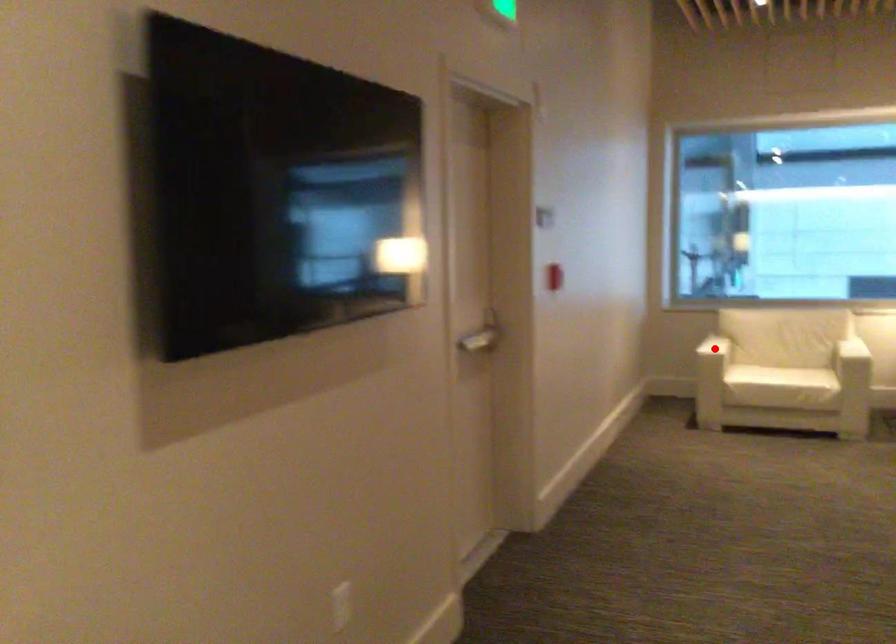
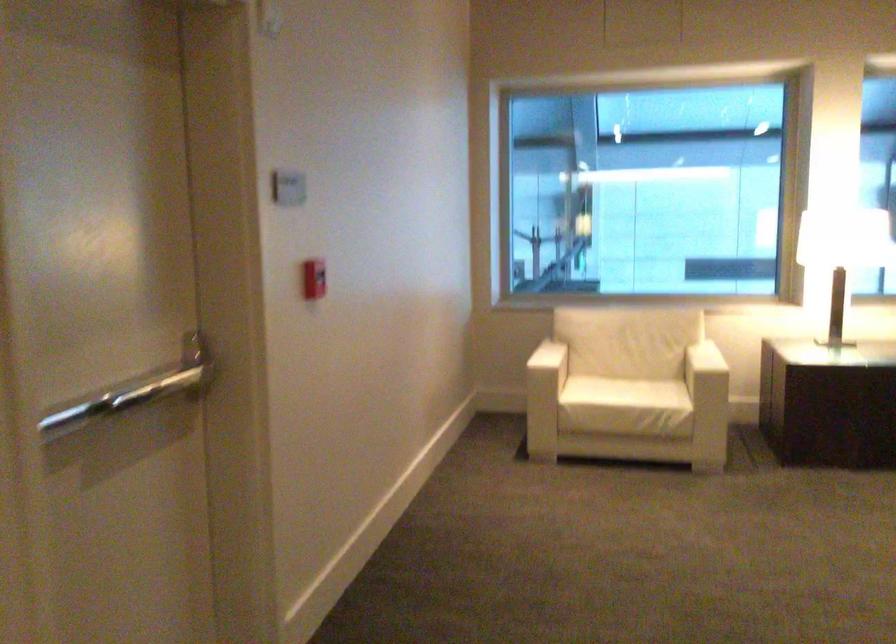
Question: A red point is marked in image1. In image2, is the corresponding 3D point closer to the camera or farther? Reply with the corresponding letter.

Choices:
 (A) The corresponding 3D point is closer.
 (B) The corresponding 3D point is farther.

Answer: (A)